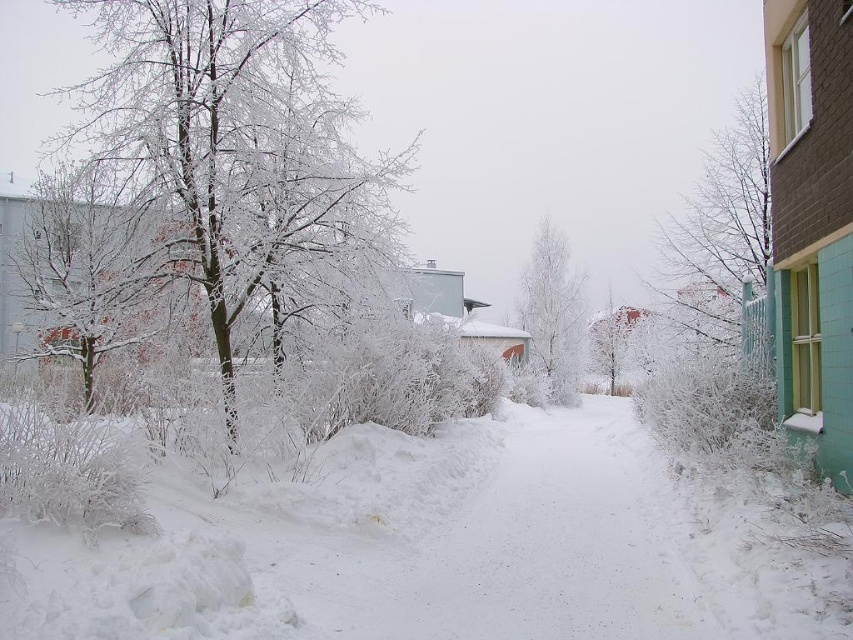
You are a photographer wanting to capture the icy white branches at left and frosty white tree at left in a single frame. Given their sizes, which one will appear bigger in the photo?

The icy white branches at left will appear bigger in the photo because it has a larger size compared to the frosty white tree at left.